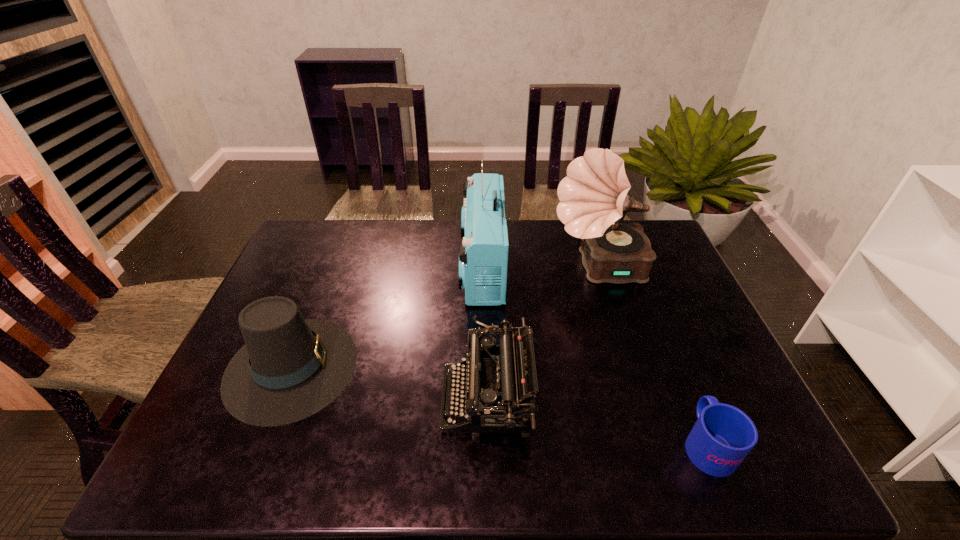
The image size is (960, 540). I want to click on vacant space that is in between the typewriter and the second tallest object, so click(485, 333).

Image resolution: width=960 pixels, height=540 pixels. What are the coordinates of `free space between the shortest object and the second tallest object` in the screenshot? It's located at [x=594, y=355].

Identify which object is located as the third nearest to the hat. Please provide its 2D coordinates. Your answer should be formatted as a tuple, i.e. [(x, y)], where the tuple contains the x and y coordinates of a point satisfying the conditions above.

[(593, 196)]

Identify which object is the second nearest to the typewriter. Please provide its 2D coordinates. Your answer should be formatted as a tuple, i.e. [(x, y)], where the tuple contains the x and y coordinates of a point satisfying the conditions above.

[(593, 196)]

The width and height of the screenshot is (960, 540). I want to click on free space that satisfies the following two spatial constraints: 1. on the front-facing side of the hat; 2. on the side with the handle of the shortest object, so click(260, 444).

Where is `vacant region that satisfies the following two spatial constraints: 1. on the side with the handle of the shortest object; 2. from the horn of the tallest object`? Image resolution: width=960 pixels, height=540 pixels. vacant region that satisfies the following two spatial constraints: 1. on the side with the handle of the shortest object; 2. from the horn of the tallest object is located at coordinates (635, 268).

Locate an element on the screen. The height and width of the screenshot is (540, 960). vacant region that satisfies the following two spatial constraints: 1. on the side with the handle of the mug; 2. from the horn of the tallest object is located at coordinates (635, 268).

Identify the location of free space that satisfies the following two spatial constraints: 1. on the side with the handle of the shortest object; 2. from the horn of the tallest object. The width and height of the screenshot is (960, 540). (635, 268).

Image resolution: width=960 pixels, height=540 pixels. Find the location of `vacant area in the image that satisfies the following two spatial constraints: 1. on the side with the handle of the shortest object; 2. on the front-facing side of the hat`. vacant area in the image that satisfies the following two spatial constraints: 1. on the side with the handle of the shortest object; 2. on the front-facing side of the hat is located at coordinates (675, 367).

Where is `free space that satisfies the following two spatial constraints: 1. on the side with the handle of the shortest object; 2. on the front-facing side of the radio receiver`? This screenshot has width=960, height=540. free space that satisfies the following two spatial constraints: 1. on the side with the handle of the shortest object; 2. on the front-facing side of the radio receiver is located at coordinates pos(634,267).